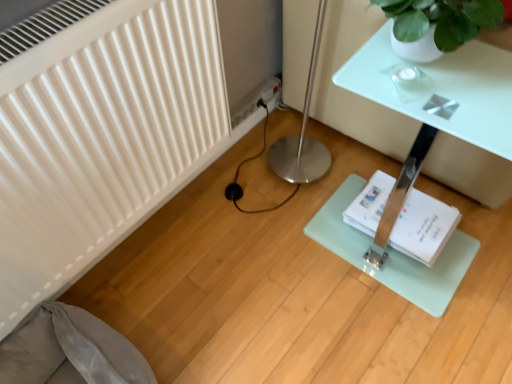
This screenshot has width=512, height=384. I want to click on vacant area that lies between white paper book at center and gray fabric swivel chair at lower left, so click(x=263, y=292).